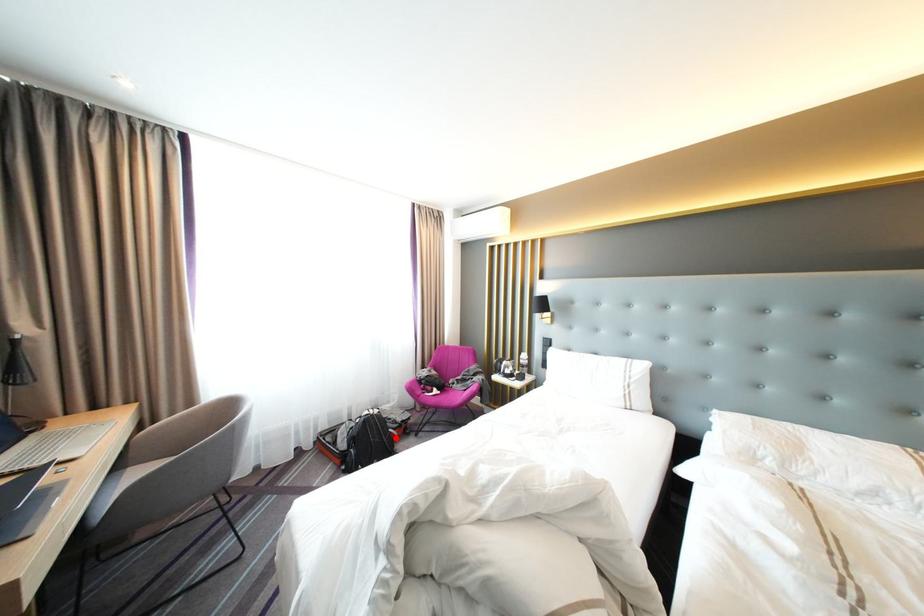
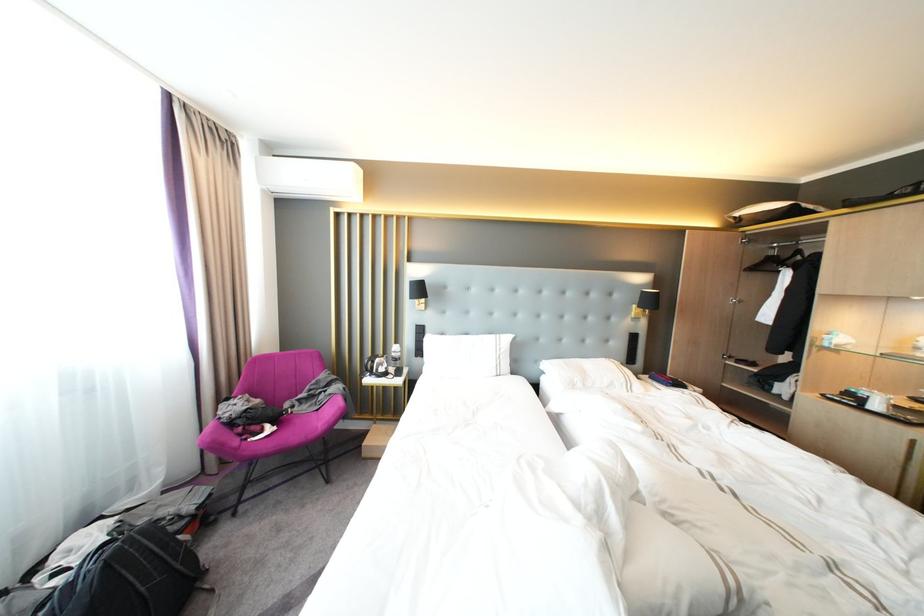
Where in the second image is the point corresponding to the highlighted location from the first image?

(186, 564)